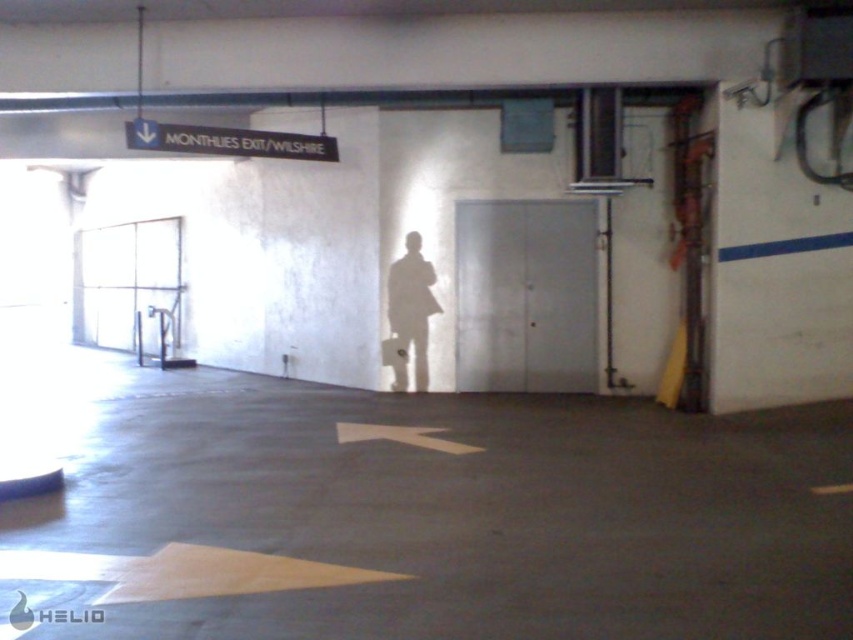
You are a delivery person standing at the entrance of the parking garage. You need to decide whether to take the concrete floor at center or the metallic gray elevator at center to reach the first floor quickly. Which path is wider?

The concrete floor at center is wider than the metallic gray elevator at center, so the concrete floor at center would allow for a quicker passage.

You are a delivery person trying to locate the elevator in the parking garage. You see the metallic gray elevator at center and the white plastic sign at upper center. Which object is closer to your current position if you are standing at the center of the garage?

The metallic gray elevator at center is closer to your current position because it is at the center, while the white plastic sign at upper center is further away.

You are a maintenance worker needing to reach the white plastic sign at upper center to replace it. You have a ladder that is 3 meters long. Is the ladder long enough to reach the sign from the metallic gray elevator at center?

The distance between the metallic gray elevator at center and the white plastic sign at upper center is 3.17 meters. Since the ladder is only 3 meters long, it is not long enough to reach the sign from the elevator.